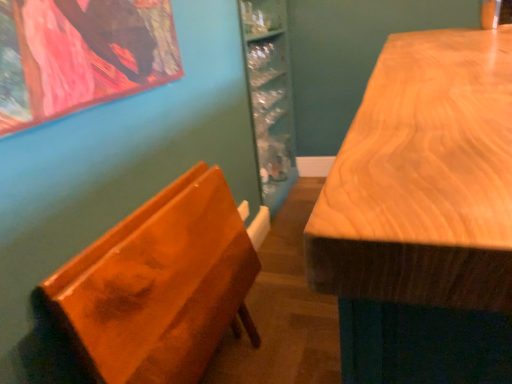
Question: From a real-world perspective, is wooden table at right physically below glossy wood chair at left?

Choices:
 (A) no
 (B) yes

Answer: (A)

Question: Could you tell me if wooden table at right is facing glossy wood chair at left?

Choices:
 (A) yes
 (B) no

Answer: (A)

Question: Does wooden table at right have a larger size compared to glossy wood chair at left?

Choices:
 (A) no
 (B) yes

Answer: (B)

Question: Can you confirm if wooden table at right is thinner than glossy wood chair at left?

Choices:
 (A) no
 (B) yes

Answer: (A)

Question: Is the depth of wooden table at right greater than that of glossy wood chair at left?

Choices:
 (A) yes
 (B) no

Answer: (B)

Question: Considering the relative positions of wooden table at right and glossy wood chair at left in the image provided, is wooden table at right to the left of glossy wood chair at left from the viewer's perspective?

Choices:
 (A) yes
 (B) no

Answer: (B)

Question: Does glossy wood chair at left come behind wooden table at right?

Choices:
 (A) yes
 (B) no

Answer: (A)

Question: Does glossy wood chair at left have a greater height compared to wooden table at right?

Choices:
 (A) no
 (B) yes

Answer: (A)

Question: Is glossy wood chair at left aimed at wooden table at right?

Choices:
 (A) no
 (B) yes

Answer: (B)

Question: Is glossy wood chair at left turned away from wooden table at right?

Choices:
 (A) yes
 (B) no

Answer: (B)

Question: Is glossy wood chair at left to the left of wooden table at right from the viewer's perspective?

Choices:
 (A) no
 (B) yes

Answer: (B)

Question: Can we say glossy wood chair at left lies outside wooden table at right?

Choices:
 (A) yes
 (B) no

Answer: (A)

Question: In terms of size, does wooden table at right appear bigger or smaller than glossy wood chair at left?

Choices:
 (A) big
 (B) small

Answer: (A)